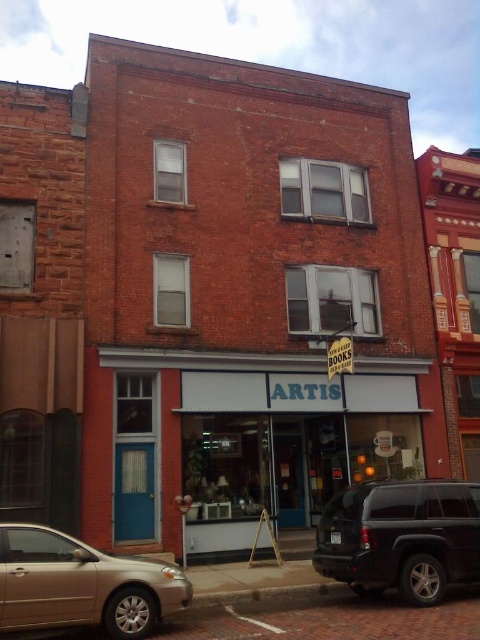
You are a pedestrian standing on the sidewalk in front of the ARTIS store. You see a shiny black suv at center and a gold metallic sedan at lower left. Which vehicle is closer to you?

The shiny black suv at center is closer to you because it is further to the viewer than the gold metallic sedan at lower left, meaning it appears nearer in the scene.

You are a pedestrian standing on the sidewalk in front of the ARTIS store. You notice a shiny black suv at center and a gold metallic sedan at lower left. Which vehicle is closer to the street level entrance of the store?

The gold metallic sedan at lower left is closer to the street level entrance of the store because the shiny black suv at center is above it, meaning the sedan is positioned lower and nearer to the entrance.